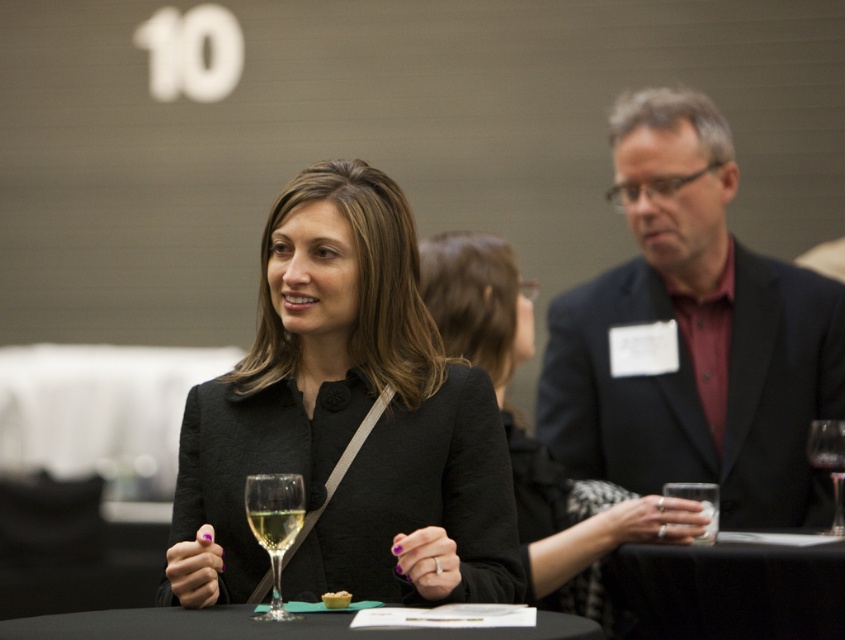
Question: Which object appears farthest from the camera in this image?

Choices:
 (A) transparent glass wine glass at center
 (B) matte black blazer at center

Answer: (A)

Question: Estimate the real-world distances between objects in this image. Which object is farther from the clear glass champagne at center?

Choices:
 (A) black glass table at center
 (B) transparent glass wine glass at center

Answer: (B)

Question: Does black matte jacket at center lie in front of clear glass wine glass at center?

Choices:
 (A) no
 (B) yes

Answer: (A)

Question: Among these objects, which one is nearest to the camera?

Choices:
 (A) black fabric table at lower center
 (B) dark suit jacket at center

Answer: (A)

Question: Is clear glass wine glass at center wider than clear glass wine at center?

Choices:
 (A) no
 (B) yes

Answer: (B)

Question: From the image, what is the correct spatial relationship of black fabric table at lower center in relation to clear glass wine at center?

Choices:
 (A) above
 (B) below

Answer: (B)